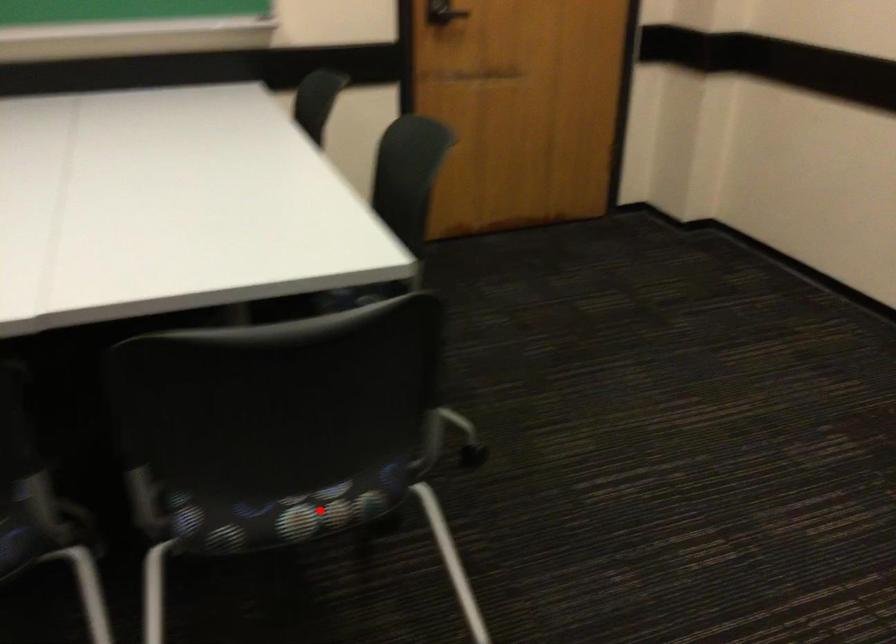
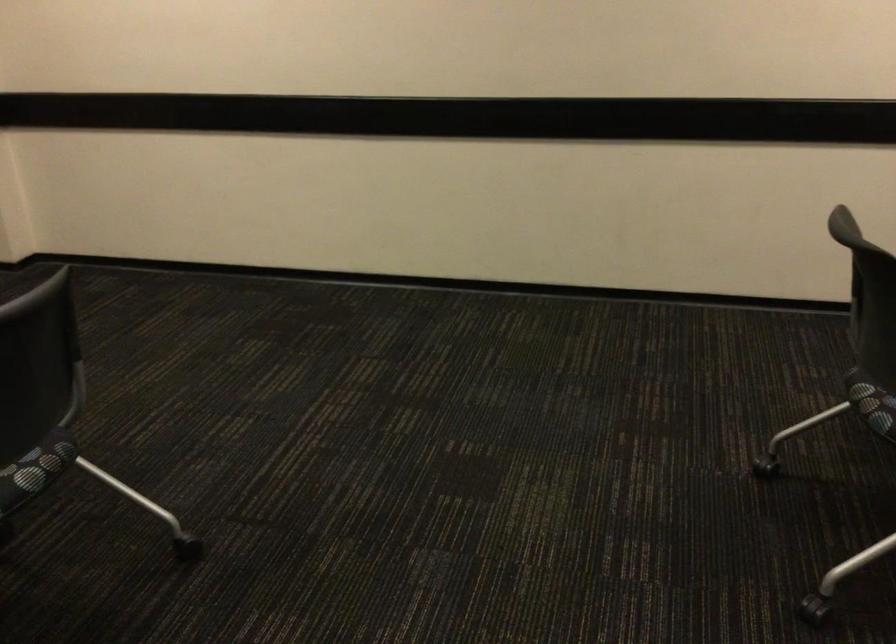
Question: I am providing you with two images of the same scene from different viewpoints. A red point is marked on the first image. Is the red point's position out of view in image 2?

Choices:
 (A) Yes
 (B) No

Answer: (B)